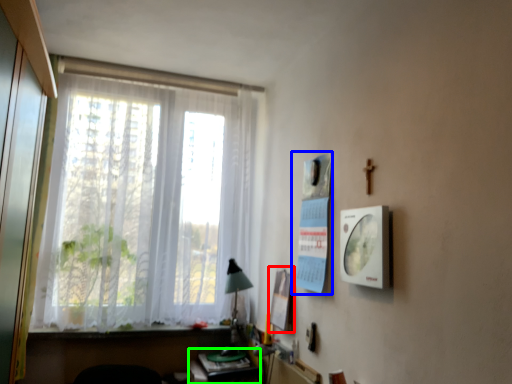
Question: Estimate the real-world distances between objects in this image. Which object is closer to poster page (highlighted by a red box), poster page (highlighted by a blue box) or table (highlighted by a green box)?

Choices:
 (A) poster page
 (B) table

Answer: (A)